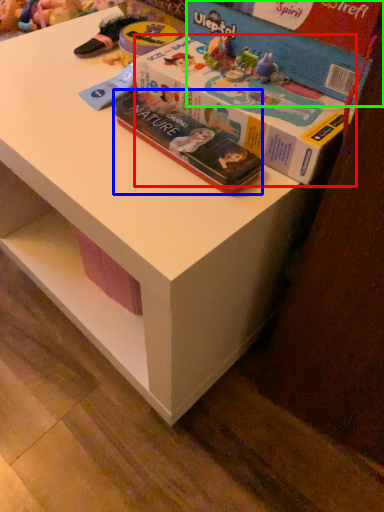
Question: Which is nearer to the box (highlighted by a red box)? book (highlighted by a blue box) or box (highlighted by a green box).

Choices:
 (A) book
 (B) box

Answer: (A)